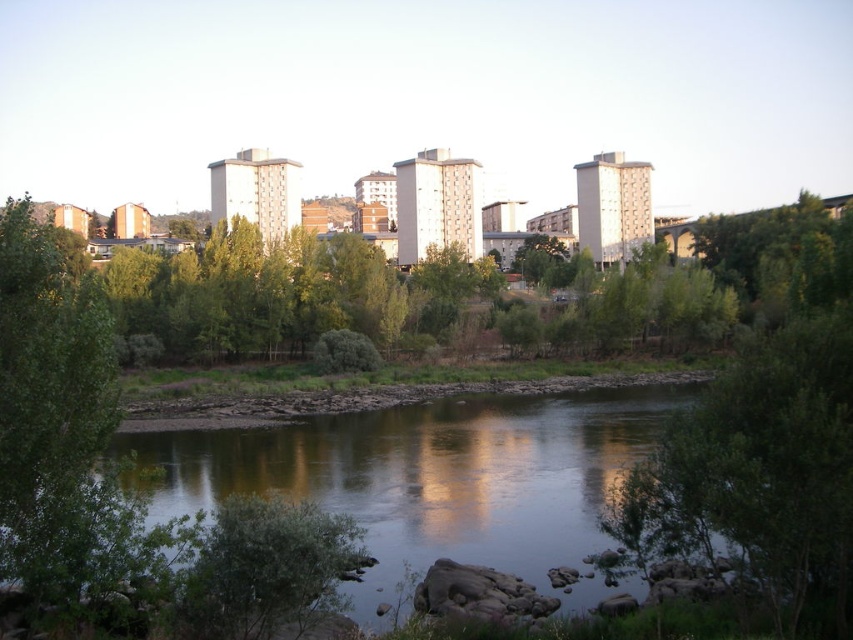
You are standing at the riverside and want to take a photo of the green leafy tree at right without the smooth reflective water at center appearing in the foreground. Is this possible based on their positions?

The green leafy tree at right is behind the smooth reflective water at center, so it is possible to take a photo of the green leafy tree at right without the smooth reflective water at center in the foreground by angling the camera to focus on the tree beyond the water.

You are standing on the riverside path and want to take a photo of the smooth reflective water at center and the green leafy tree at right. Which object should you position closer to the bottom of your camera frame?

You should position the smooth reflective water at center closer to the bottom of your camera frame because it is located below the green leafy tree at right.

Based on the photo, you are standing at the riverside and want to take a photo of both the smooth reflective water at center and the green leafy tree at right. Which object will appear taller in the photo?

The green leafy tree at right will appear taller in the photo because it has a greater height than the smooth reflective water at center.